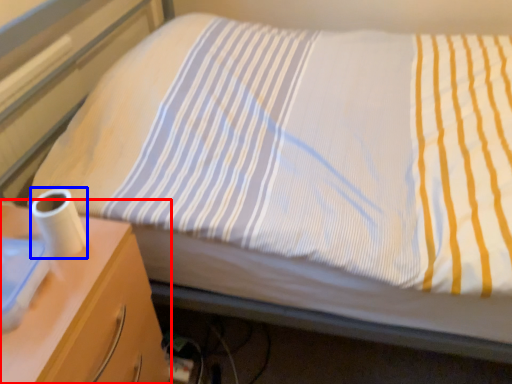
Question: Which of the following is the closest to the observer, nightstand (highlighted by a red box) or toilet paper (highlighted by a blue box)?

Choices:
 (A) nightstand
 (B) toilet paper

Answer: (A)